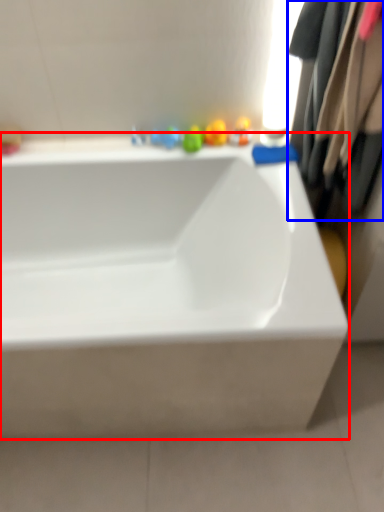
Question: Which object appears closest to the camera in this image, bathtub (highlighted by a red box) or clothing (highlighted by a blue box)?

Choices:
 (A) bathtub
 (B) clothing

Answer: (B)